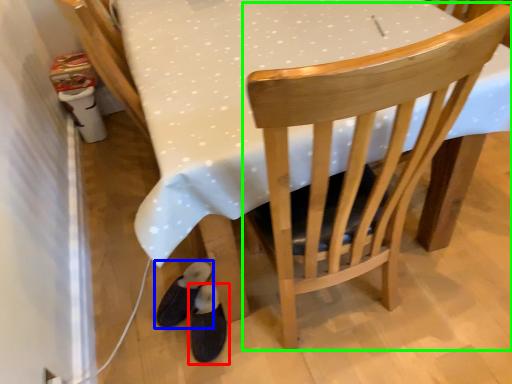
Question: Which is farther away from footwear (highlighted by a red box)? footwear (highlighted by a blue box) or chair (highlighted by a green box)?

Choices:
 (A) footwear
 (B) chair

Answer: (B)